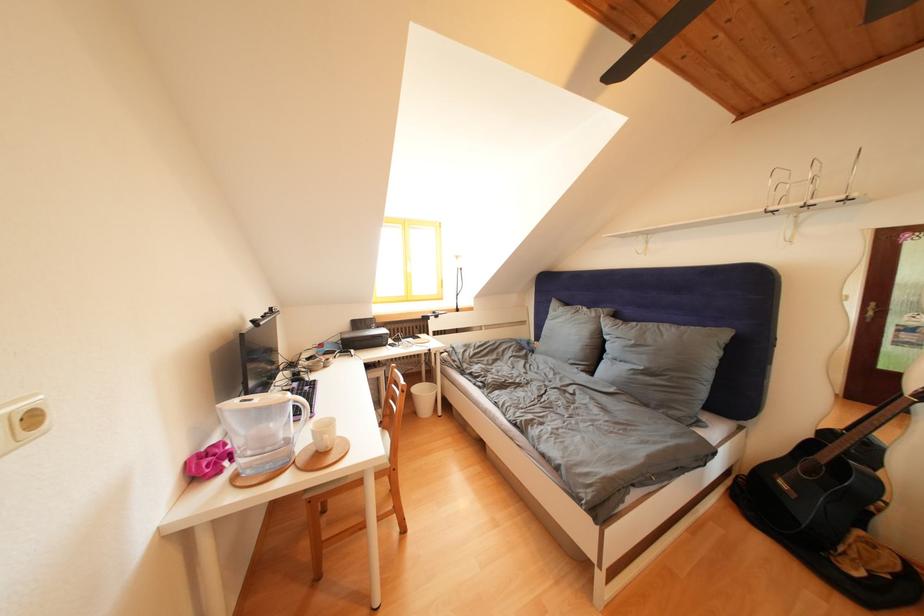
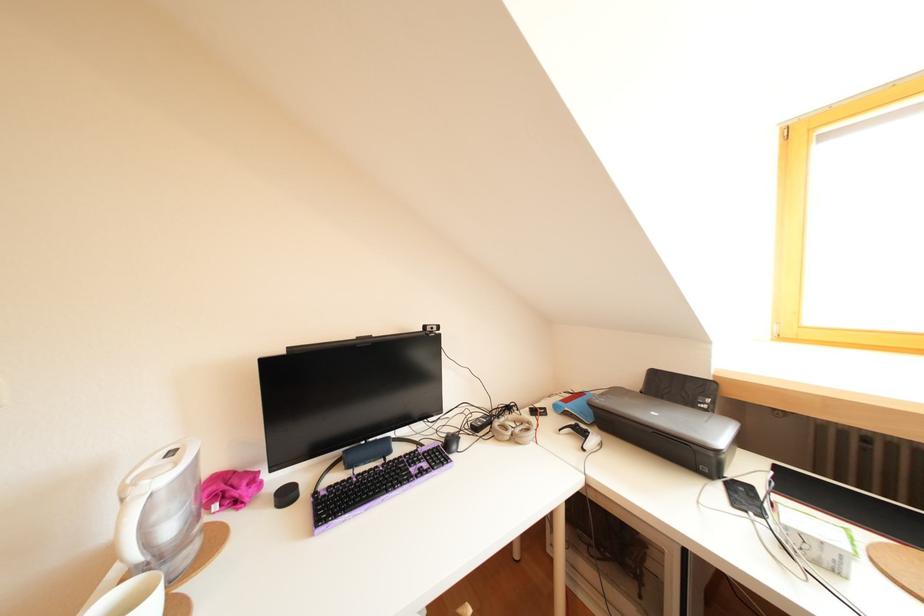
Find the pixel in the second image that matches point (355, 342) in the first image.

(610, 407)